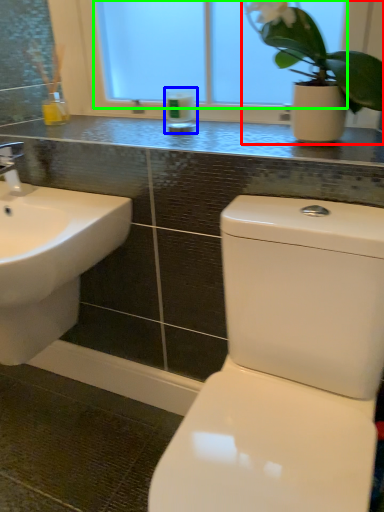
Question: Based on their relative distances, which object is nearer to houseplant (highlighted by a red box)? Choose from toiletry (highlighted by a blue box) and window screen (highlighted by a green box).

Choices:
 (A) toiletry
 (B) window screen

Answer: (B)